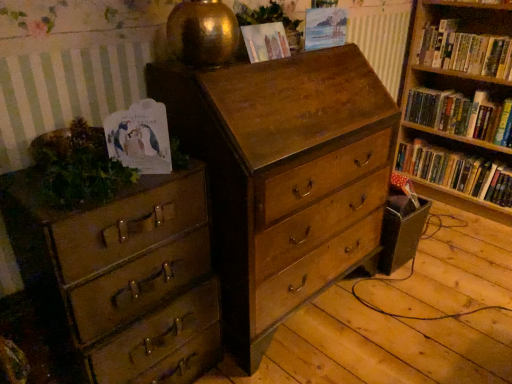
Question: From the image's perspective, is wooden chest of drawers at center, the second chest of drawers viewed from the left, located beneath matte paper at upper center, which is counted as the first paperback book, starting from the right?

Choices:
 (A) yes
 (B) no

Answer: (A)

Question: Does wooden chest of drawers at center, which is the 1th chest of drawers from right to left, have a smaller size compared to matte paper at upper center, marked as the first paperback book in a back-to-front arrangement?

Choices:
 (A) no
 (B) yes

Answer: (A)

Question: Is wooden chest of drawers at center, which is the 1th chest of drawers from right to left, bigger than matte paper at upper center, the first paperback book from the top?

Choices:
 (A) yes
 (B) no

Answer: (A)

Question: Can you confirm if wooden chest of drawers at center, the second chest of drawers viewed from the left, is shorter than matte paper at upper center, placed as the third paperback book when sorted from front to back?

Choices:
 (A) yes
 (B) no

Answer: (B)

Question: Is wooden chest of drawers at center, the second chest of drawers viewed from the left, next to matte paper at upper center, marked as the first paperback book in a back-to-front arrangement?

Choices:
 (A) no
 (B) yes

Answer: (A)

Question: Is wooden chest of drawers at center, which is the 1th chest of drawers from right to left, closer to camera compared to matte paper at upper center, the 3th paperback book positioned from the bottom?

Choices:
 (A) no
 (B) yes

Answer: (B)

Question: Considering the relative sizes of hardcover book at right, the third book from the top, and green leafy plant at left, the 1th plant viewed from the front, in the image provided, is hardcover book at right, the third book from the top, bigger than green leafy plant at left, the 1th plant viewed from the front,?

Choices:
 (A) no
 (B) yes

Answer: (B)

Question: Considering the relative positions of hardcover book at right, the 1th book positioned from the bottom, and green leafy plant at left, the 1th plant viewed from the front, in the image provided, is hardcover book at right, the 1th book positioned from the bottom, behind green leafy plant at left, the 1th plant viewed from the front,?

Choices:
 (A) no
 (B) yes

Answer: (B)

Question: From the image's perspective, is hardcover book at right, the 1th book positioned from the bottom, below green leafy plant at left, marked as the second plant in a right-to-left arrangement?

Choices:
 (A) yes
 (B) no

Answer: (B)

Question: Does hardcover book at right, the third book from the top, turn towards green leafy plant at left, which is the first plant from left to right?

Choices:
 (A) yes
 (B) no

Answer: (B)

Question: Can we say hardcover book at right, the third book from the top, lies outside green leafy plant at left, the 1th plant viewed from the front?

Choices:
 (A) no
 (B) yes

Answer: (B)

Question: Is hardcover book at right, the 1th book positioned from the bottom, next to green leafy plant at left, positioned as the 2th plant in back-to-front order, and touching it?

Choices:
 (A) yes
 (B) no

Answer: (B)

Question: Is hardcover book at right, placed as the second book when sorted from bottom to top, far away from hardcover book at right, the 1th book positioned from the bottom?

Choices:
 (A) yes
 (B) no

Answer: (B)